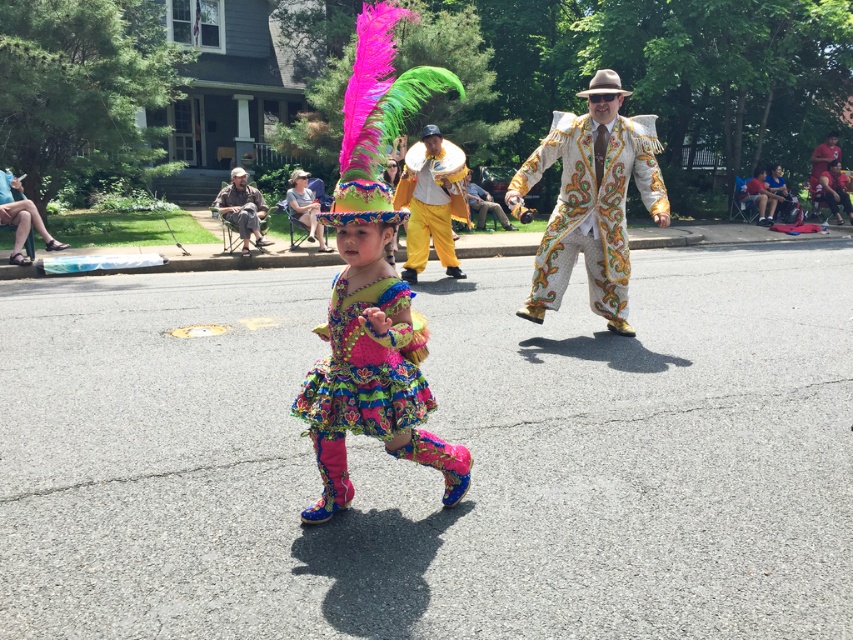
Question: Does white textured suit at center have a larger size compared to matte red shirt at center?

Choices:
 (A) yes
 (B) no

Answer: (A)

Question: Is white textured suit at center behind yellow satin suit at center?

Choices:
 (A) no
 (B) yes

Answer: (A)

Question: Based on their relative distances, which object is farther from the multicolored sequined dress at center?

Choices:
 (A) matte yellow hat at upper center
 (B) beige fabric chair at left

Answer: (B)

Question: Considering the real-world distances, which object is closest to the yellow satin suit at center?

Choices:
 (A) multicolored sequined dress at center
 (B) matte red shirt at center
 (C) beige fabric chair at left

Answer: (C)

Question: Which object appears closest to the camera in this image?

Choices:
 (A) matte red shirt at center
 (B) multicolored sequined dress at center
 (C) matte yellow hat at upper center

Answer: (B)

Question: From the image, what is the correct spatial relationship of multicolored sequined dress at center in relation to matte yellow hat at upper center?

Choices:
 (A) right
 (B) left

Answer: (A)